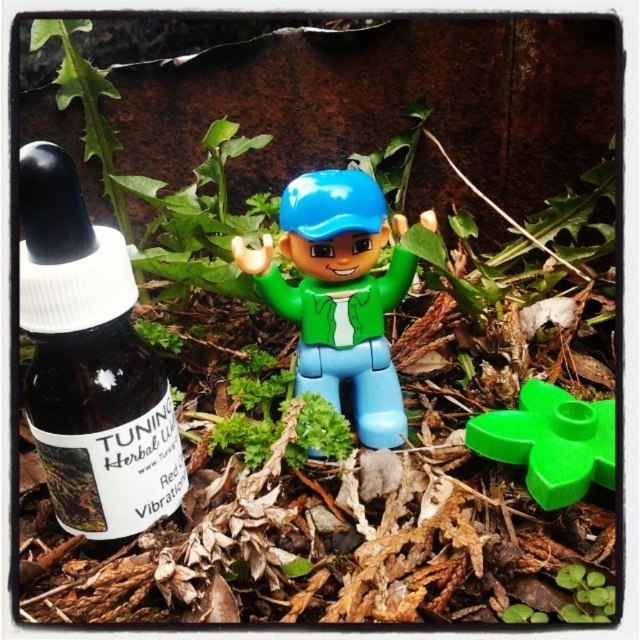
Does matte plastic toy at center appear over green plastic flower at center?

Yes.

Is matte plastic toy at center wider than green plastic flower at center?

Indeed, matte plastic toy at center has a greater width compared to green plastic flower at center.

Find the location of a particular element. matte plastic toy at center is located at coordinates (339, 294).

Find the location of a particular element. This screenshot has height=640, width=640. matte plastic toy at center is located at coordinates (339, 294).

Who is positioned more to the left, transparent glass bottle at left or matte plastic toy at center?

From the viewer's perspective, transparent glass bottle at left appears more on the left side.

Based on the photo, can you confirm if transparent glass bottle at left is wider than matte plastic toy at center?

No.

Is point (93, 324) closer to viewer compared to point (300, 284)?

Yes, it is.

The width and height of the screenshot is (640, 640). Identify the location of transparent glass bottle at left. (90, 364).

Where is `transparent glass bottle at left`? This screenshot has height=640, width=640. transparent glass bottle at left is located at coordinates (90, 364).

Measure the distance from transparent glass bottle at left to green plastic flower at center.

The distance of transparent glass bottle at left from green plastic flower at center is 16.62 inches.

Where is `transparent glass bottle at left`? The height and width of the screenshot is (640, 640). transparent glass bottle at left is located at coordinates (90, 364).